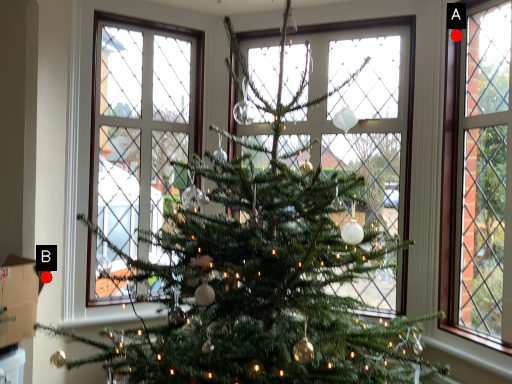
Question: Two points are circled on the image, labeled by A and B beside each circle. Which of the following is the closest to the observer?

Choices:
 (A) A is closer
 (B) B is closer

Answer: (B)